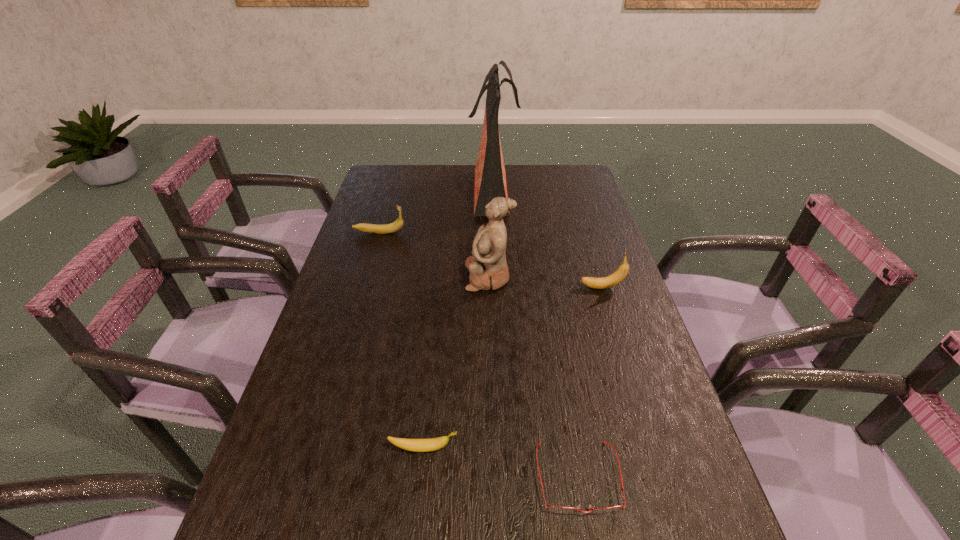
Select which object appears as the closest to the tallest object. Please provide its 2D coordinates. Your answer should be formatted as a tuple, i.e. [(x, y)], where the tuple contains the x and y coordinates of a point satisfying the conditions above.

[(398, 224)]

You are a GUI agent. You are given a task and a screenshot of the screen. Output one action in this format:
    pyautogui.click(x=<x>, y=<y>)
    Task: Click on the third closest banana relative to the figurine
    The width and height of the screenshot is (960, 540).
    Given the screenshot: What is the action you would take?
    pyautogui.click(x=416, y=445)

Identify the location of banana that is the closest to the shopping bag. The height and width of the screenshot is (540, 960). (398, 224).